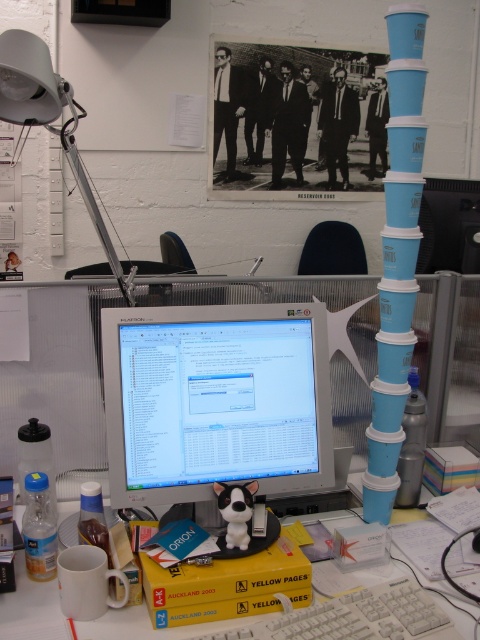
Question: Is white plastic keyboard at center bigger than white plastic computer desk at center?

Choices:
 (A) yes
 (B) no

Answer: (B)

Question: Which of the following is the closest to the observer?

Choices:
 (A) matte silver monitor at center
 (B) white plastic computer desk at center
 (C) white plastic keyboard at center

Answer: (C)

Question: Can you confirm if matte silver monitor at center is smaller than white plastic keyboard at center?

Choices:
 (A) yes
 (B) no

Answer: (B)

Question: Can you confirm if white plastic keyboard at center is bigger than white plastic computer desk at center?

Choices:
 (A) no
 (B) yes

Answer: (A)

Question: Estimate the real-world distances between objects in this image. Which object is closer to the white plastic computer desk at center?

Choices:
 (A) white plastic keyboard at center
 (B) matte silver monitor at center

Answer: (A)

Question: Which point appears closest to the camera in this image?

Choices:
 (A) (261, 408)
 (B) (467, 612)
 (C) (337, 618)

Answer: (C)